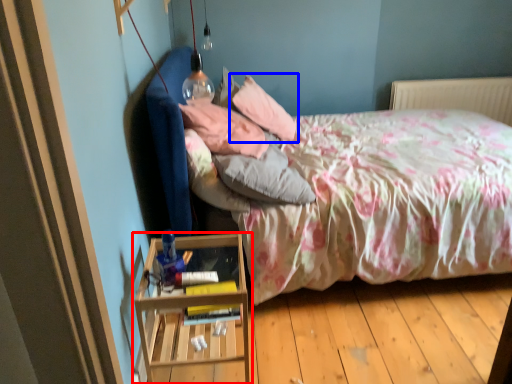
Question: Which of the following is the closest to the observer, nightstand (highlighted by a red box) or pillow (highlighted by a blue box)?

Choices:
 (A) nightstand
 (B) pillow

Answer: (A)